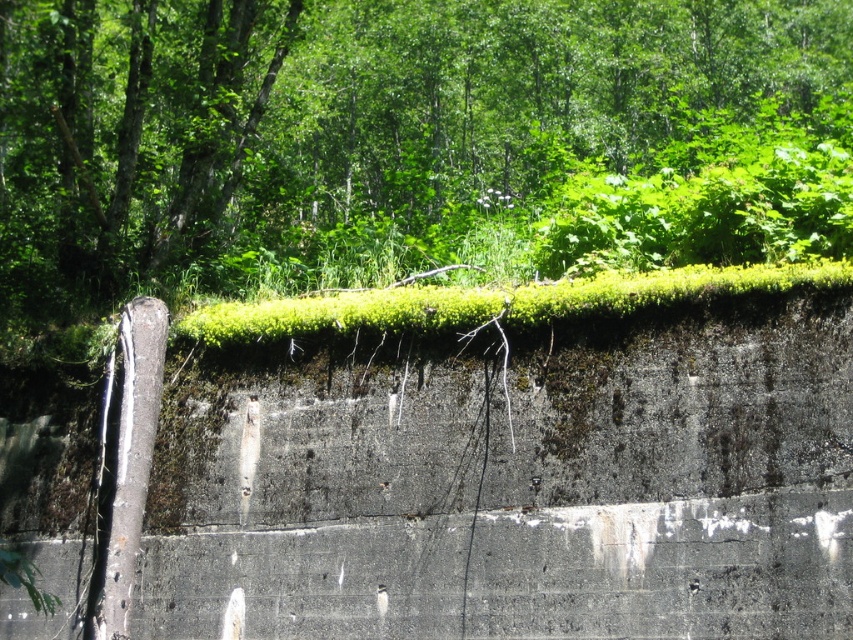
What is the 2D coordinate of the green mossy concrete at upper center in the image?

The 2D coordinate of the green mossy concrete at upper center is at point (x=502, y=483).

You are standing in front of the concrete wall and want to touch both the green mossy concrete at upper center and the green leafy tree at upper center. Which object will you need to reach out further to touch?

The green leafy tree at upper center is further away from the viewer than the green mossy concrete at upper center, so you will need to reach out further to touch the green leafy tree at upper center.